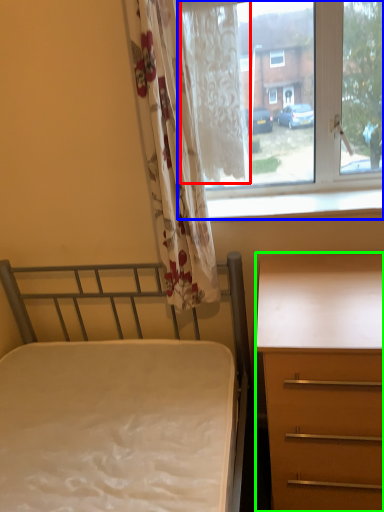
Question: Estimate the real-world distances between objects in this image. Which object is closer to curtain (highlighted by a red box), window (highlighted by a blue box) or desk (highlighted by a green box)?

Choices:
 (A) window
 (B) desk

Answer: (A)